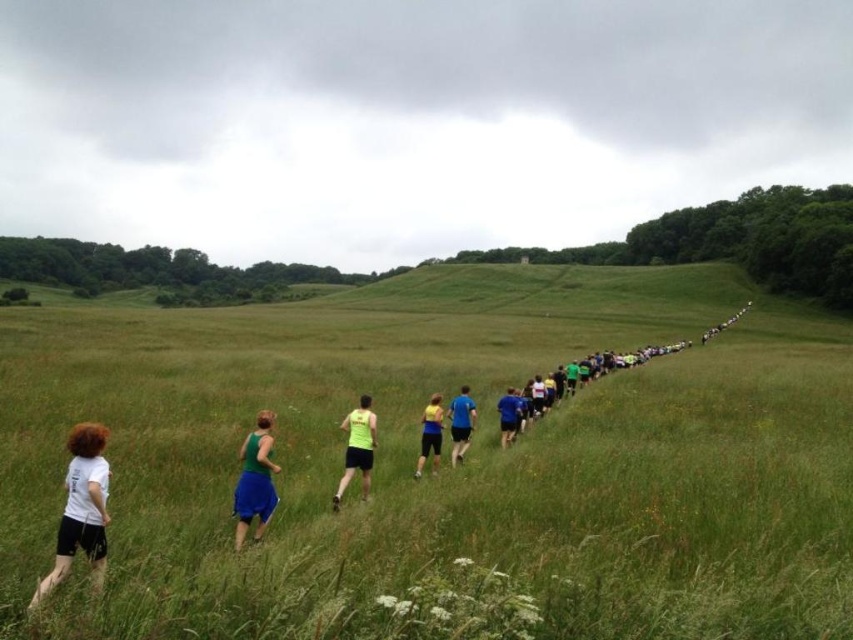
In the scene shown: You are a runner in the middle of the grassy field. You see two runners at coordinates point (367, 477). How far apart are they?

The two runners at coordinates point (367, 477) are 19.30 meters apart.